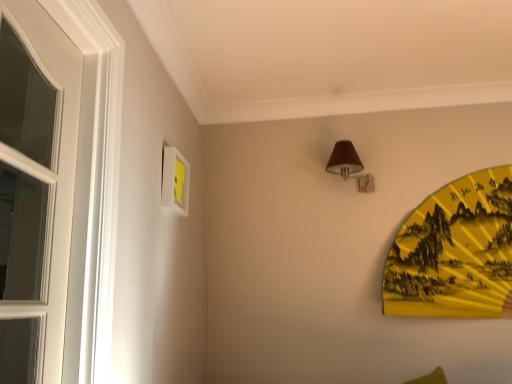
Question: Considering the relative sizes of white matte picture frame at upper left and yellow paper fan at right in the image provided, is white matte picture frame at upper left bigger than yellow paper fan at right?

Choices:
 (A) yes
 (B) no

Answer: (B)

Question: Is white matte picture frame at upper left positioned before yellow paper fan at right?

Choices:
 (A) yes
 (B) no

Answer: (A)

Question: Can you confirm if white matte picture frame at upper left is taller than yellow paper fan at right?

Choices:
 (A) yes
 (B) no

Answer: (B)

Question: Is white matte picture frame at upper left to the left of yellow paper fan at right from the viewer's perspective?

Choices:
 (A) no
 (B) yes

Answer: (B)

Question: Considering the relative sizes of white matte picture frame at upper left and yellow paper fan at right in the image provided, is white matte picture frame at upper left smaller than yellow paper fan at right?

Choices:
 (A) no
 (B) yes

Answer: (B)

Question: Can you confirm if white matte picture frame at upper left is shorter than yellow paper fan at right?

Choices:
 (A) no
 (B) yes

Answer: (B)

Question: Is yellow paper fan at right outside of white matte picture frame at upper left?

Choices:
 (A) no
 (B) yes

Answer: (B)

Question: From the image's perspective, does yellow paper fan at right appear higher than white matte picture frame at upper left?

Choices:
 (A) no
 (B) yes

Answer: (A)

Question: Can you confirm if yellow paper fan at right is positioned to the left of white matte picture frame at upper left?

Choices:
 (A) yes
 (B) no

Answer: (B)

Question: Would you say yellow paper fan at right is a long distance from white matte picture frame at upper left?

Choices:
 (A) yes
 (B) no

Answer: (A)

Question: From a real-world perspective, is yellow paper fan at right positioned under white matte picture frame at upper left based on gravity?

Choices:
 (A) yes
 (B) no

Answer: (A)

Question: From a real-world perspective, is yellow paper fan at right located higher than white matte picture frame at upper left?

Choices:
 (A) yes
 (B) no

Answer: (B)

Question: Is yellow paper fan at right facing towards brown fabric lampshade at upper center?

Choices:
 (A) no
 (B) yes

Answer: (A)